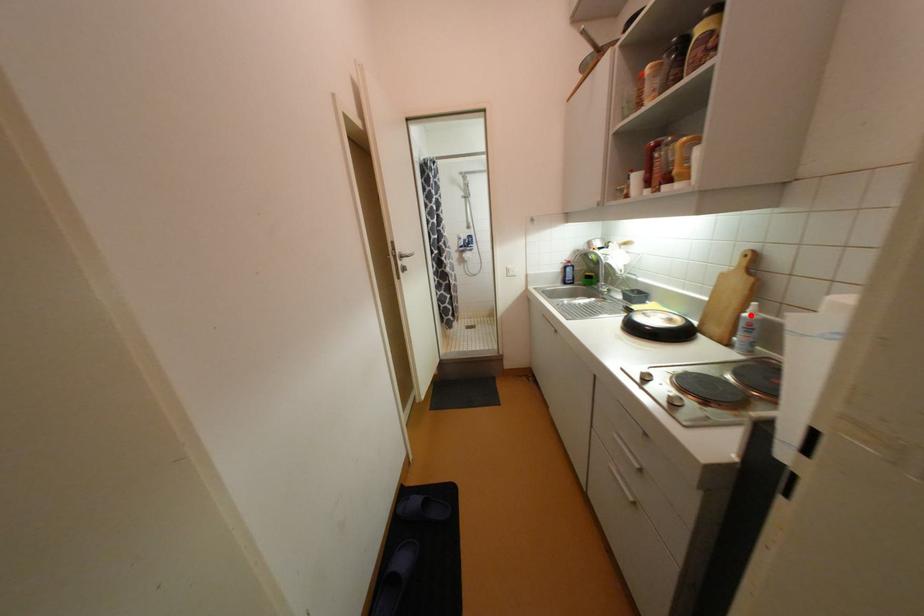
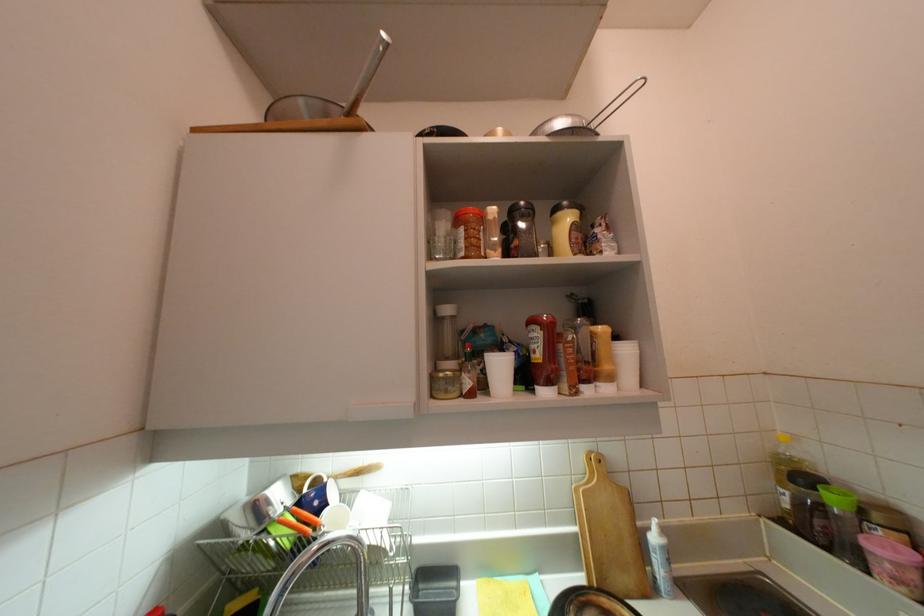
Where in the second image is the point corresponding to the highlighted location from the first image?

(660, 540)